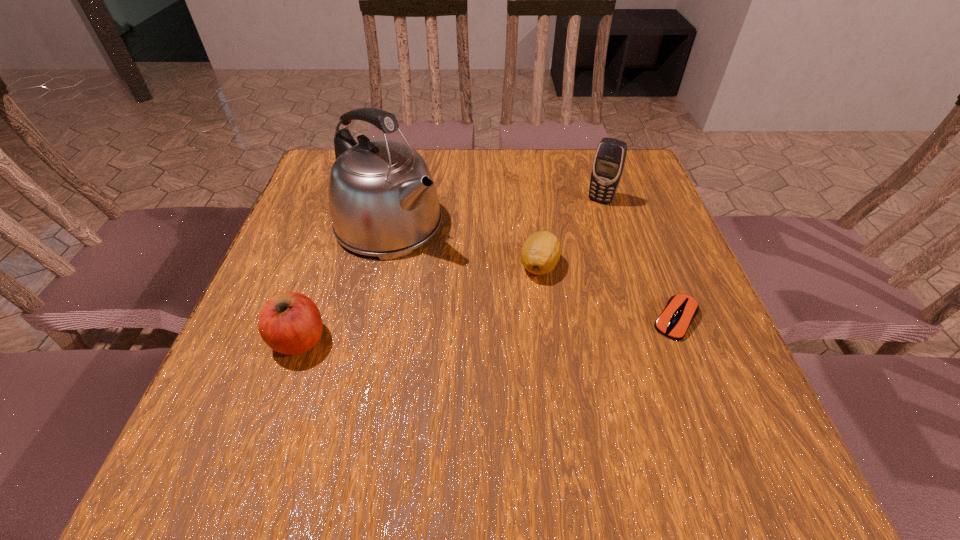
This screenshot has width=960, height=540. What are the coordinates of `free space on the desktop that is between the third tallest object and the shortest object and is positioned at the stem end of the third object from right to left` in the screenshot? It's located at (468, 330).

You are a GUI agent. You are given a task and a screenshot of the screen. Output one action in this format:
    pyautogui.click(x=<x>, y=<y>)
    Task: Click on the vacant spot on the desktop that is between the apple and the shortest object and is positioned on the front face of the cellular telephone
    This screenshot has width=960, height=540.
    Given the screenshot: What is the action you would take?
    (x=529, y=327)

I want to click on free space on the desktop that is between the apple and the shortest object and is positioned on the spout of the tallest object, so click(x=534, y=327).